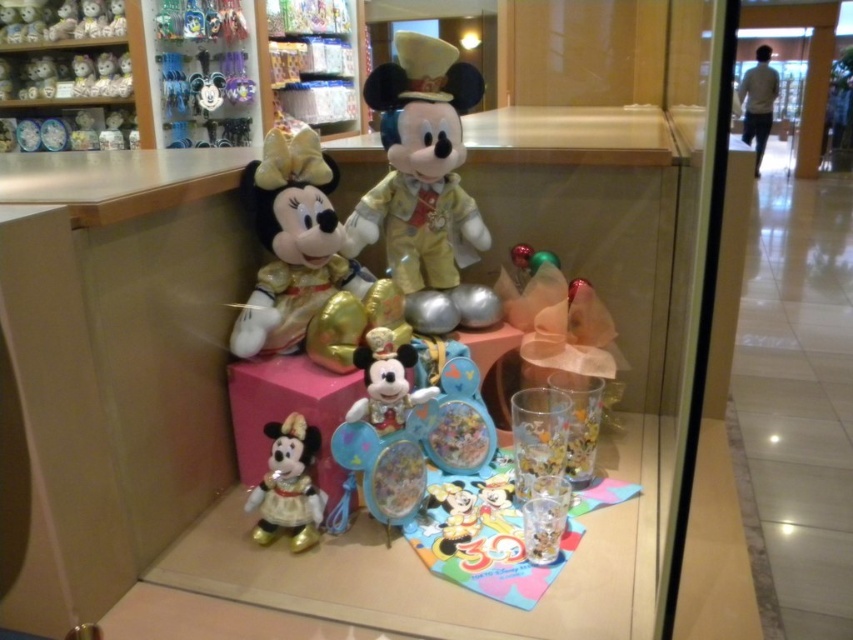
Question: Is shiny gold plush at center positioned in front of gold plush minnie mouse at center?

Choices:
 (A) no
 (B) yes

Answer: (A)

Question: Which point is farther to the camera?

Choices:
 (A) gold shiny minnie mouse at lower left
 (B) gold plush minnie mouse at center
 (C) matte black plush at upper left
 (D) shiny gold plush at center

Answer: (C)

Question: Considering the real-world distances, which object is farthest from the matte black plush at upper left?

Choices:
 (A) gold plush minnie mouse at center
 (B) shiny gold plush at center
 (C) gold shiny minnie mouse at lower left

Answer: (C)

Question: Does shiny gold plush at center have a larger size compared to gold plush minnie mouse at center?

Choices:
 (A) no
 (B) yes

Answer: (B)

Question: Which point is closer to the camera?

Choices:
 (A) (453, 88)
 (B) (326, 230)
 (C) (254, 538)
 (D) (91, 77)

Answer: (C)

Question: Can you confirm if gold plush minnie mouse at center is positioned above gold shiny minnie mouse at lower left?

Choices:
 (A) no
 (B) yes

Answer: (B)